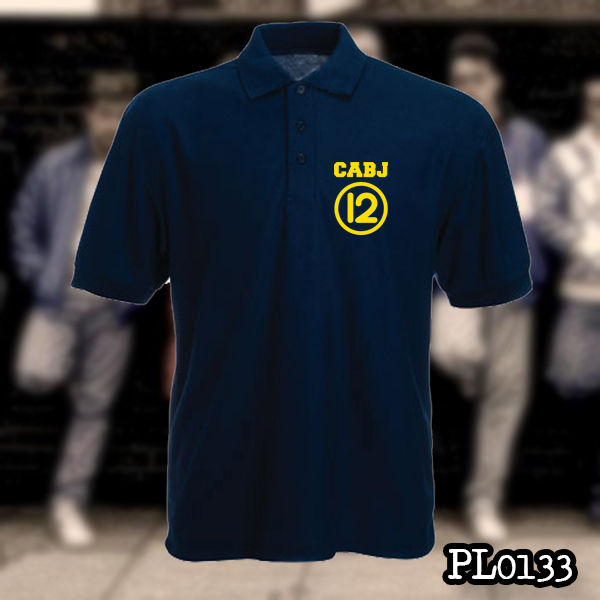
You are a GUI agent. You are given a task and a screenshot of the screen. Output one action in this format:
    pyautogui.click(x=<x>, y=<y>)
    Task: Click on the brick wall
    This screenshot has height=600, width=600.
    Given the screenshot: What is the action you would take?
    pyautogui.click(x=45, y=112)